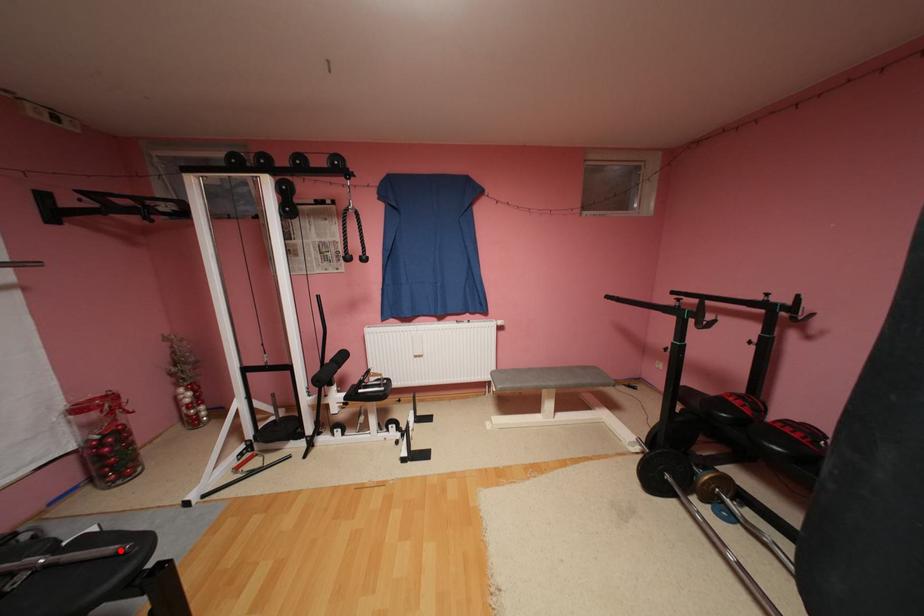
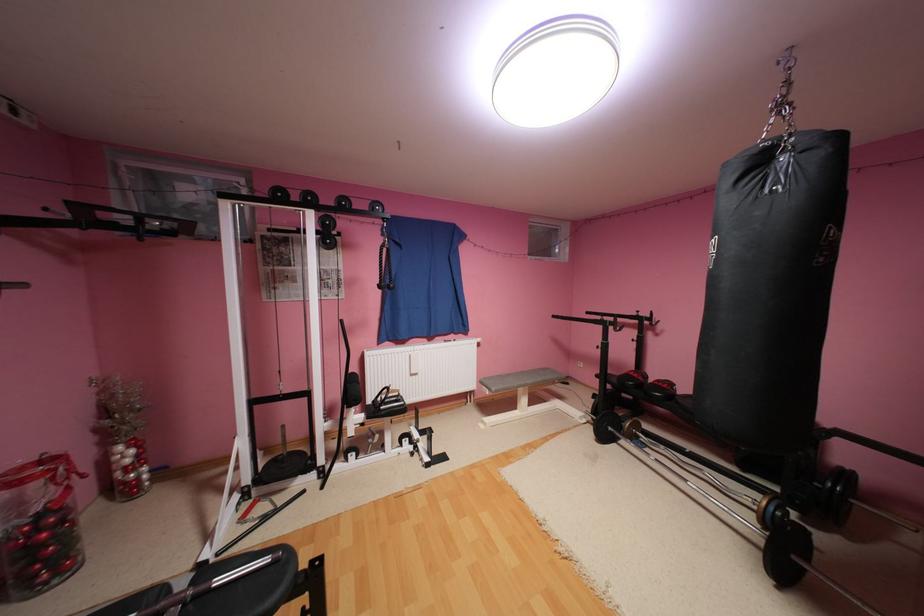
Question: I am providing you with two images of the same scene from different viewpoints. A red point is shown in image1. For the corresponding object point in image2, is it positioned nearer or farther from the camera?

Choices:
 (A) Nearer
 (B) Farther

Answer: (B)